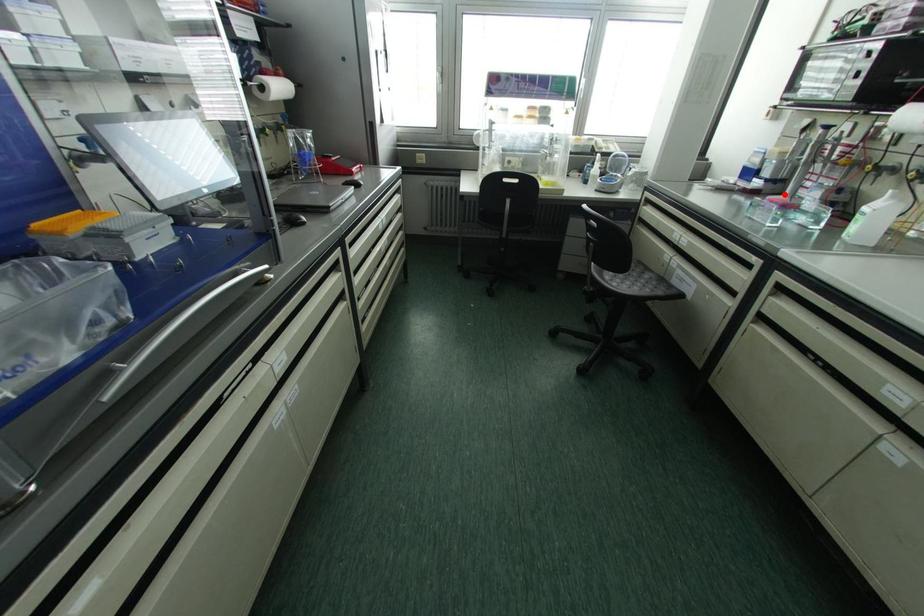
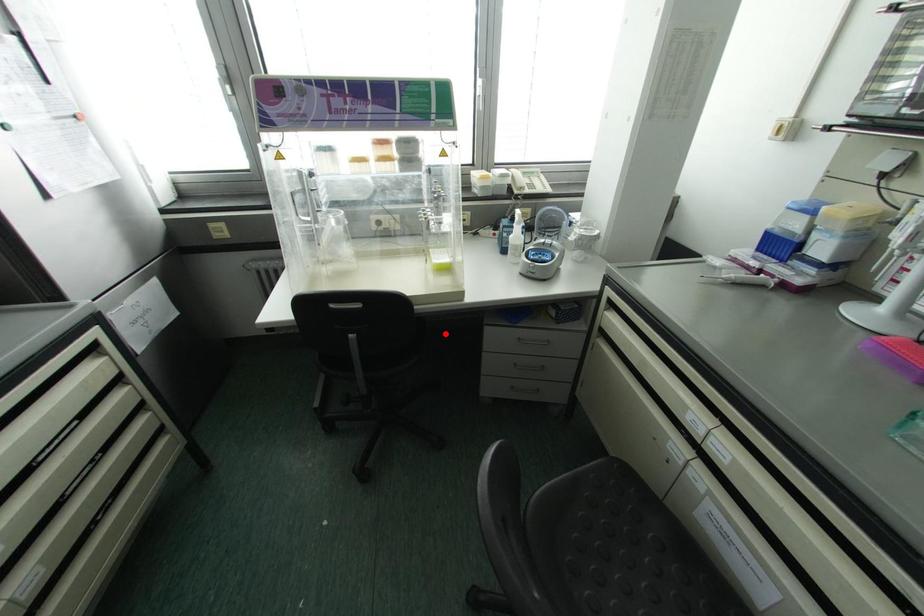
I am providing you with two images of the same scene from different viewpoints. A red point is marked on the first image and another point is marked on the second image. Is the marked point in image1 the same physical position as the marked point in image2?

No